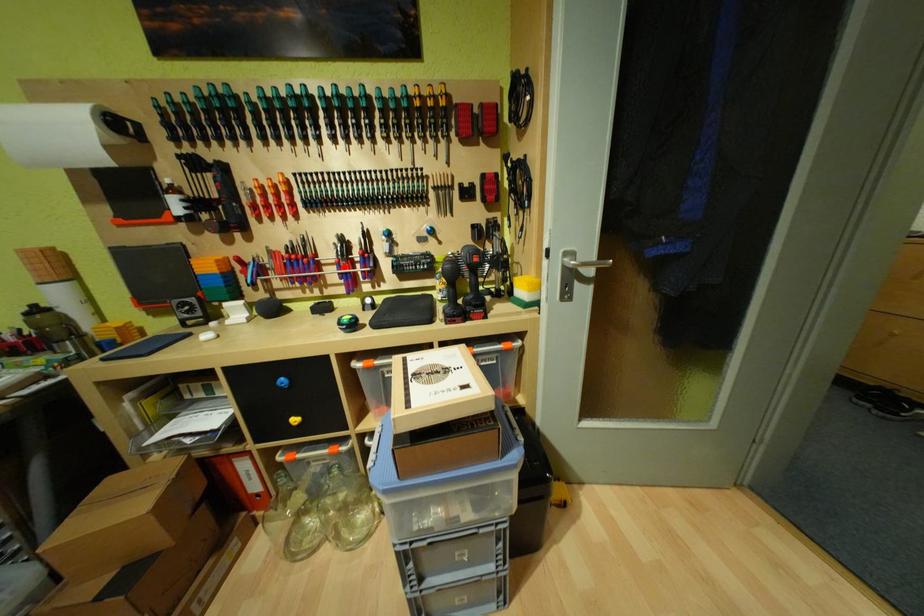
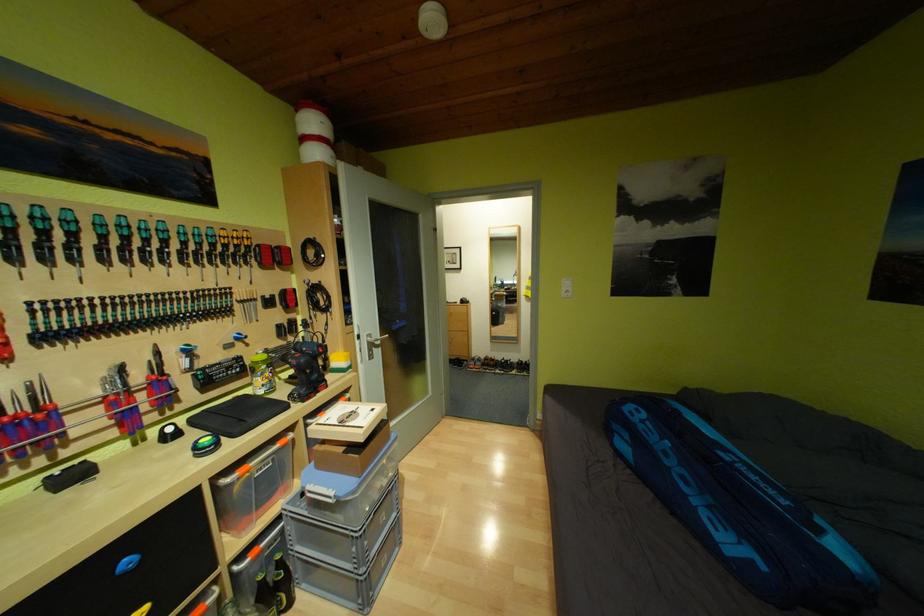
Locate, in the second image, the point that corresponds to the highlighted location in the first image.

(111, 408)